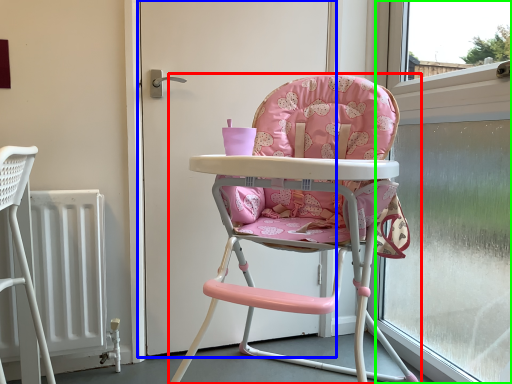
Question: Which object is the closest to the chair (highlighted by a red box)? Choose among these: screen door (highlighted by a blue box) or window screen (highlighted by a green box).

Choices:
 (A) screen door
 (B) window screen

Answer: (A)